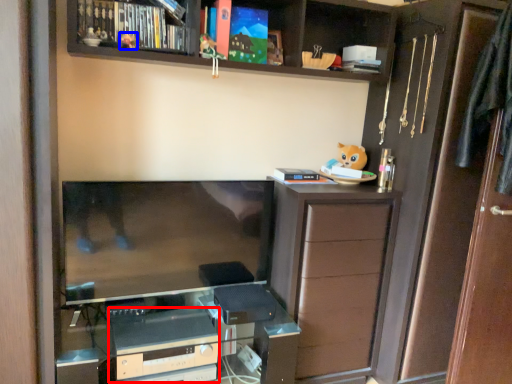
Question: Which point is further to the camera, appliance (highlighted by a red box) or toy (highlighted by a blue box)?

Choices:
 (A) appliance
 (B) toy

Answer: (A)